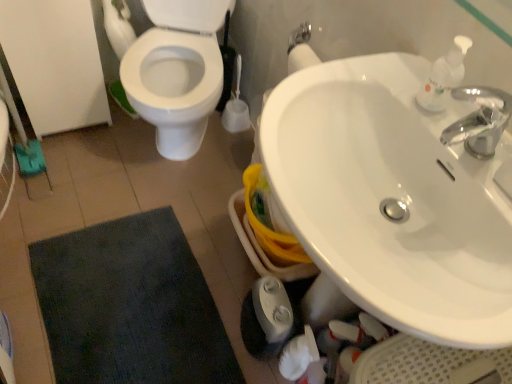
Question: Is white glossy sink at upper right not inside white plastic soap dispenser at upper right?

Choices:
 (A) yes
 (B) no

Answer: (A)

Question: From the image's perspective, is white glossy sink at upper right located above white plastic soap dispenser at upper right?

Choices:
 (A) yes
 (B) no

Answer: (B)

Question: Can you confirm if white glossy sink at upper right is shorter than white plastic soap dispenser at upper right?

Choices:
 (A) yes
 (B) no

Answer: (B)

Question: From the image's perspective, is white glossy sink at upper right below white plastic soap dispenser at upper right?

Choices:
 (A) yes
 (B) no

Answer: (A)

Question: Is white glossy sink at upper right aimed at white plastic soap dispenser at upper right?

Choices:
 (A) no
 (B) yes

Answer: (A)

Question: Is dark blue textured bath mat at lower left spatially inside white plastic soap dispenser at upper right, or outside of it?

Choices:
 (A) outside
 (B) inside

Answer: (A)

Question: Considering the positions of dark blue textured bath mat at lower left and white plastic soap dispenser at upper right in the image, is dark blue textured bath mat at lower left wider or thinner than white plastic soap dispenser at upper right?

Choices:
 (A) thin
 (B) wide

Answer: (B)

Question: Would you say dark blue textured bath mat at lower left is to the left or to the right of white plastic soap dispenser at upper right in the picture?

Choices:
 (A) left
 (B) right

Answer: (A)

Question: From a real-world perspective, is dark blue textured bath mat at lower left physically located above or below white plastic soap dispenser at upper right?

Choices:
 (A) above
 (B) below

Answer: (B)

Question: In terms of height, does white plastic soap dispenser at upper right look taller or shorter compared to dark blue textured bath mat at lower left?

Choices:
 (A) short
 (B) tall

Answer: (B)

Question: Considering the positions of white plastic soap dispenser at upper right and dark blue textured bath mat at lower left in the image, is white plastic soap dispenser at upper right bigger or smaller than dark blue textured bath mat at lower left?

Choices:
 (A) big
 (B) small

Answer: (B)

Question: From a real-world perspective, relative to dark blue textured bath mat at lower left, is white plastic soap dispenser at upper right vertically above or below?

Choices:
 (A) above
 (B) below

Answer: (A)

Question: From the image's perspective, is white plastic soap dispenser at upper right located above or below dark blue textured bath mat at lower left?

Choices:
 (A) above
 (B) below

Answer: (A)

Question: Is dark blue textured bath mat at lower left wider or thinner than white glossy sink at upper right?

Choices:
 (A) wide
 (B) thin

Answer: (A)

Question: In the image, is dark blue textured bath mat at lower left positioned in front of or behind white glossy sink at upper right?

Choices:
 (A) behind
 (B) front

Answer: (A)